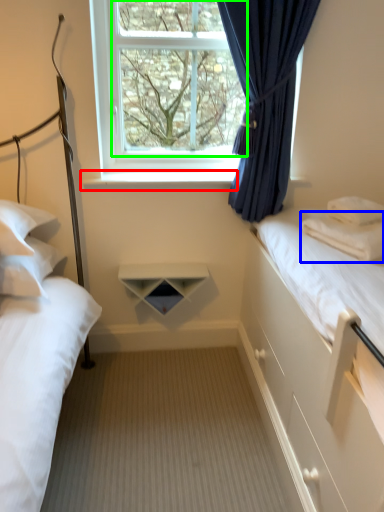
Question: Considering the real-world distances, which object is closest to window sill (highlighted by a red box)? pillow (highlighted by a blue box) or window screen (highlighted by a green box).

Choices:
 (A) pillow
 (B) window screen

Answer: (B)